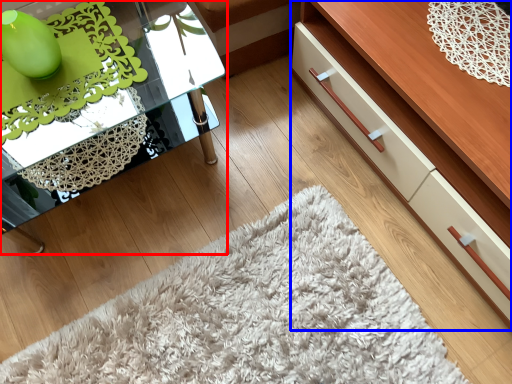
Question: Which point is closer to the camera, table (highlighted by a red box) or dresser (highlighted by a blue box)?

Choices:
 (A) table
 (B) dresser

Answer: (B)